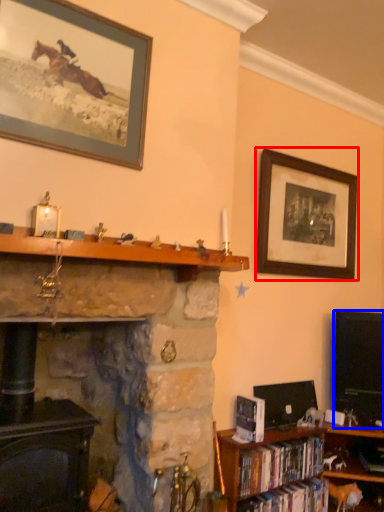
Question: Which of the following is the farthest to the observer, picture frame (highlighted by a red box) or television (highlighted by a blue box)?

Choices:
 (A) picture frame
 (B) television

Answer: (B)